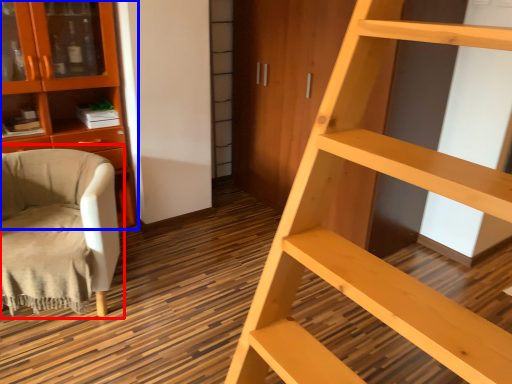
Question: Among these objects, which one is nearest to the camera, chair (highlighted by a red box) or cabinetry (highlighted by a blue box)?

Choices:
 (A) chair
 (B) cabinetry

Answer: (A)